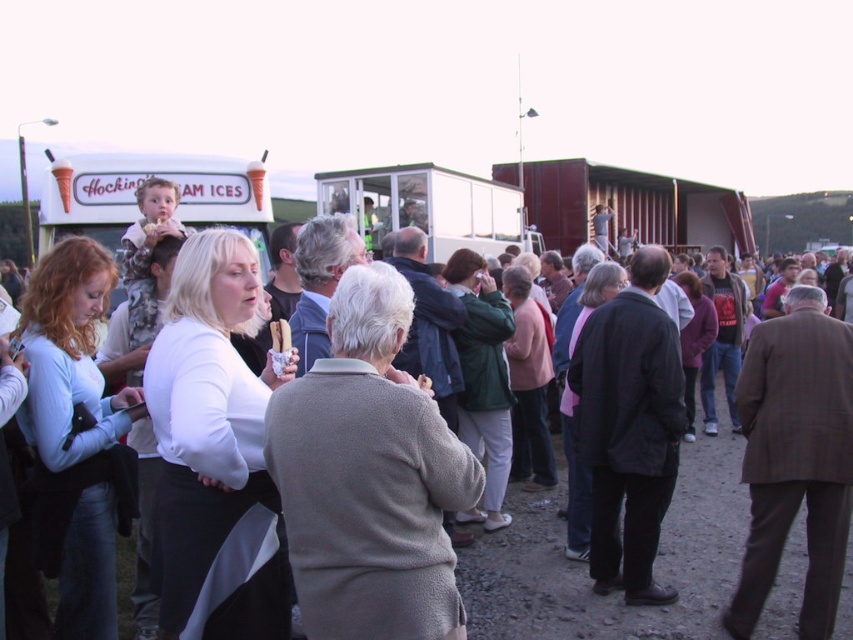
Question: Can you confirm if white cotton shirt at center is bigger than white plastic food truck at center?

Choices:
 (A) yes
 (B) no

Answer: (B)

Question: Which point is farther to the camera?

Choices:
 (A) (436, 209)
 (B) (83, 188)

Answer: (A)

Question: Which of the following is the farthest from the observer?

Choices:
 (A) white plastic food truck at center
 (B) white plastic ice cream truck at upper left
 (C) white cotton shirt at center

Answer: (A)

Question: Can you confirm if white plastic ice cream truck at upper left is positioned to the left of white plastic food truck at center?

Choices:
 (A) no
 (B) yes

Answer: (B)

Question: Is white cotton shirt at center above white plastic food truck at center?

Choices:
 (A) yes
 (B) no

Answer: (B)

Question: Based on their relative distances, which object is nearer to the white cotton shirt at center?

Choices:
 (A) white plastic ice cream truck at upper left
 (B) white plastic food truck at center

Answer: (A)